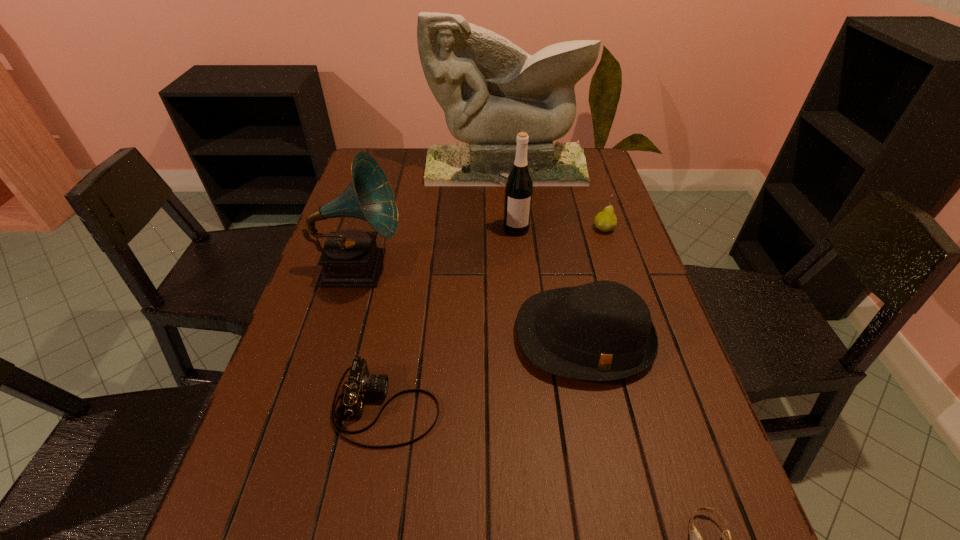
What are the coordinates of `free point at the far edge` in the screenshot? It's located at (422, 173).

Where is `vacant space at the left edge of the desktop`? This screenshot has width=960, height=540. vacant space at the left edge of the desktop is located at coordinates (250, 449).

Image resolution: width=960 pixels, height=540 pixels. Identify the location of free region at the right edge. (624, 258).

Locate an element on the screen. This screenshot has width=960, height=540. vacant region between the fifth tallest object and the sculpture is located at coordinates pyautogui.click(x=555, y=198).

Find the location of a particular element. Image resolution: width=960 pixels, height=540 pixels. empty space between the phonograph_record and the camera is located at coordinates (372, 338).

Image resolution: width=960 pixels, height=540 pixels. What are the coordinates of `free space between the phonograph_record and the fedora` in the screenshot? It's located at (471, 302).

The image size is (960, 540). Identify the location of free space between the fifth tallest object and the wine bottle. (560, 228).

The image size is (960, 540). I want to click on free space between the wine bottle and the fedora, so click(x=550, y=283).

Identify the location of unoccupied position between the sculpture and the phonograph_record. This screenshot has width=960, height=540. (432, 218).

In order to click on free space between the camera and the farthest object in this screenshot , I will do `click(445, 287)`.